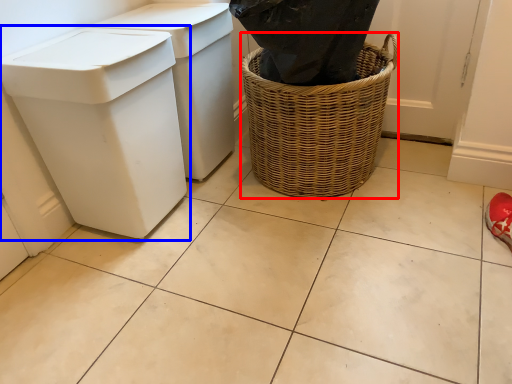
Question: Which object is closer to the camera taking this photo, basket container (highlighted by a red box) or waste container (highlighted by a blue box)?

Choices:
 (A) basket container
 (B) waste container

Answer: (B)